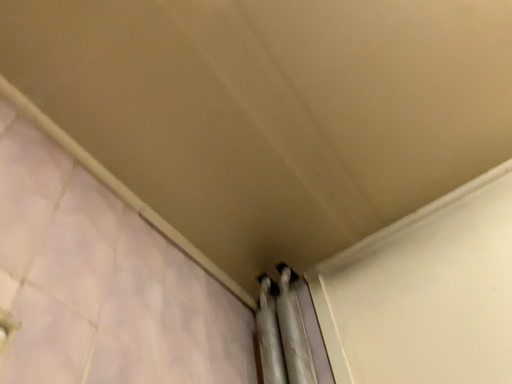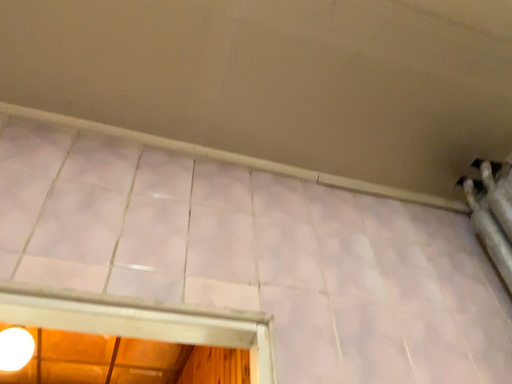
Question: How did the camera likely rotate when shooting the video?

Choices:
 (A) rotated downward
 (B) rotated upward

Answer: (A)